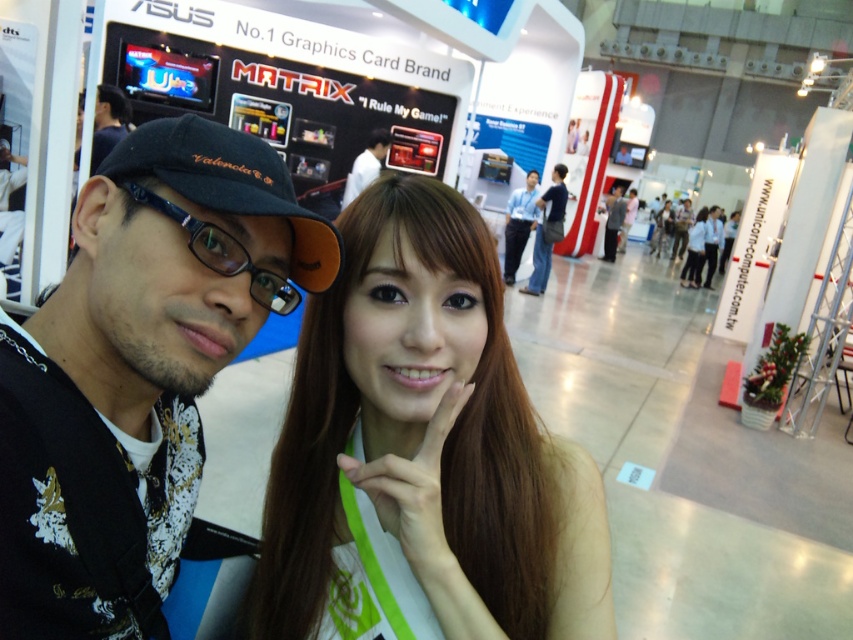
Please describe the location of the blue shirt at center in terms of coordinates within the image. The image has a coordinate system where the top left corner is the origin point, and the bottom right corner is the maximum point. The coordinates are given as a pair of values between 0 and 1, representing the horizontal and vertical positions respectively. The first value is the horizontal coordinate, and the second is the vertical coordinate. The coordinates are precise to three decimal places. The question

The blue shirt at center is located at coordinates point (x=519, y=224).

You are at a tech expo and see two people taking a selfie. You notice a black fabric baseball cap at center and a matte black hair at center. Which object is positioned to the right?

The matte black hair at center is positioned to the right of the black fabric baseball cap at center.